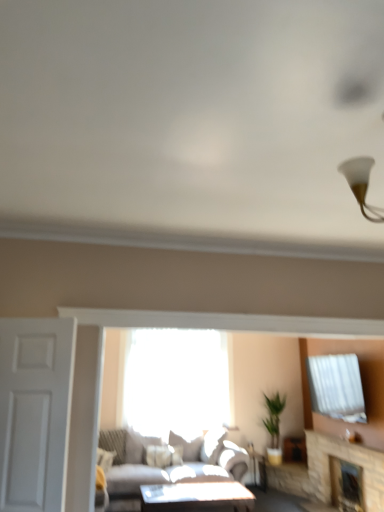
Question: Is matte white table at center outside of stone fireplace at lower right, the first fireplace positioned from the front?

Choices:
 (A) no
 (B) yes

Answer: (B)

Question: From a real-world perspective, is matte white table at center located beneath stone fireplace at lower right, the first fireplace positioned from the front?

Choices:
 (A) yes
 (B) no

Answer: (A)

Question: Can you confirm if matte white table at center is positioned to the right of stone fireplace at lower right, the first fireplace positioned from the front?

Choices:
 (A) no
 (B) yes

Answer: (A)

Question: From a real-world perspective, is matte white table at center located higher than stone fireplace at lower right, the second fireplace in the back-to-front sequence?

Choices:
 (A) no
 (B) yes

Answer: (A)

Question: Does matte white table at center lie in front of stone fireplace at lower right, the first fireplace positioned from the front?

Choices:
 (A) no
 (B) yes

Answer: (A)

Question: Looking at the image, does matte white side table at lower center seem bigger or smaller compared to stone fireplace at lower right, marked as the second fireplace in a front-to-back arrangement?

Choices:
 (A) big
 (B) small

Answer: (A)

Question: Is point (266, 479) closer or farther from the camera than point (342, 505)?

Choices:
 (A) farther
 (B) closer

Answer: (A)

Question: Looking at their shapes, would you say matte white side table at lower center is wider or thinner than stone fireplace at lower right, the first fireplace from the back?

Choices:
 (A) wide
 (B) thin

Answer: (A)

Question: Is matte white side table at lower center in front of or behind stone fireplace at lower right, the first fireplace from the back, in the image?

Choices:
 (A) front
 (B) behind

Answer: (B)

Question: Do you think stone fireplace at lower right, the first fireplace from the back, is within matte white table at center, or outside of it?

Choices:
 (A) inside
 (B) outside

Answer: (B)

Question: Considering their positions, is stone fireplace at lower right, marked as the second fireplace in a front-to-back arrangement, located in front of or behind matte white table at center?

Choices:
 (A) front
 (B) behind

Answer: (B)

Question: Considering the positions of stone fireplace at lower right, the first fireplace from the back, and matte white table at center in the image, is stone fireplace at lower right, the first fireplace from the back, taller or shorter than matte white table at center?

Choices:
 (A) short
 (B) tall

Answer: (B)

Question: Would you say stone fireplace at lower right, marked as the second fireplace in a front-to-back arrangement, is to the left or to the right of matte white table at center in the picture?

Choices:
 (A) right
 (B) left

Answer: (A)

Question: Considering the relative positions of light gray fabric couch at center and transparent glass window at center in the image provided, is light gray fabric couch at center to the left or to the right of transparent glass window at center?

Choices:
 (A) right
 (B) left

Answer: (A)

Question: Based on their sizes in the image, would you say light gray fabric couch at center is bigger or smaller than transparent glass window at center?

Choices:
 (A) big
 (B) small

Answer: (A)